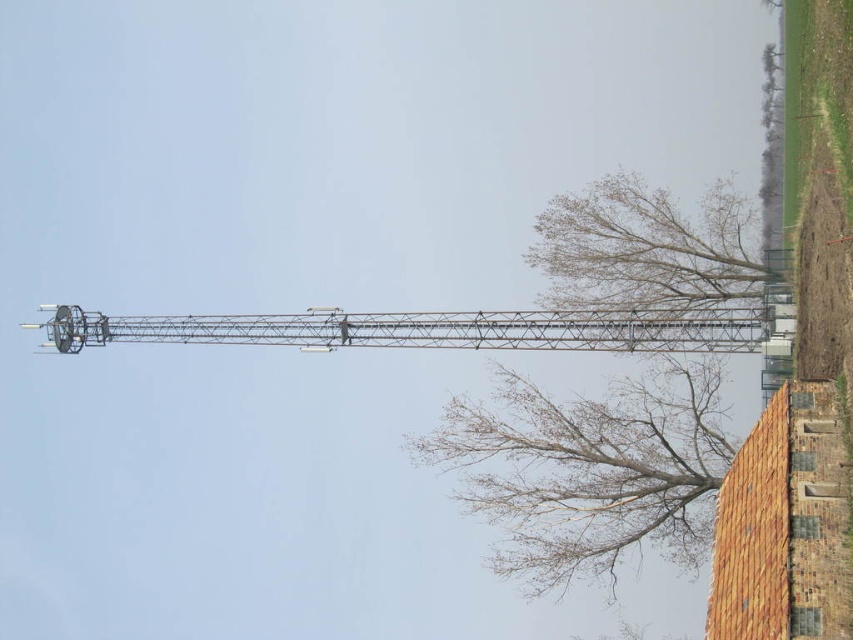
You are a bird flying towards the tower and want to land on the bare branches at upper right. If your wingspan is 3 feet, will you have enough space to land there without touching the tower?

The distance of bare branches at upper right from camera is 333.14 feet. Since the tower is much farther away than your wingspan, you have more than enough space to land on the bare branches at upper right without touching the tower.

Based on the photo, you are an observer looking at the tower and the small building. You notice two sets of bare branches in the image. Which set of bare branches, the bare branches at lower right or the bare branches at upper right, is located to the left of the other?

The bare branches at lower right is positioned on the left side of bare branches at upper right.

You are standing in the open field looking at the tower. There is a small building with a tiled roof to the right of the tower. Where is the bare branches at upper right located relative to the small building with a tiled roof?

The bare branches at upper right are located at point (653,250) relative to the small building with a tiled roof.